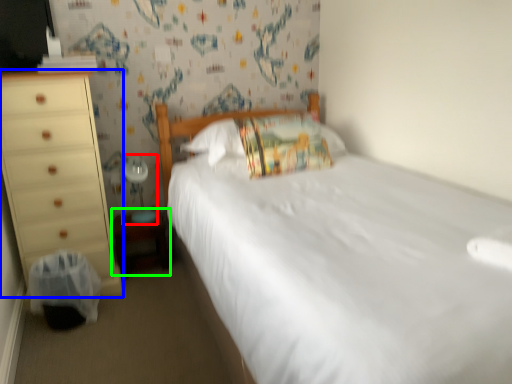
Question: Which object is positioned closest to table lamp (highlighted by a red box)? Select from chest of drawers (highlighted by a blue box) and changing table (highlighted by a green box).

Choices:
 (A) chest of drawers
 (B) changing table

Answer: (B)